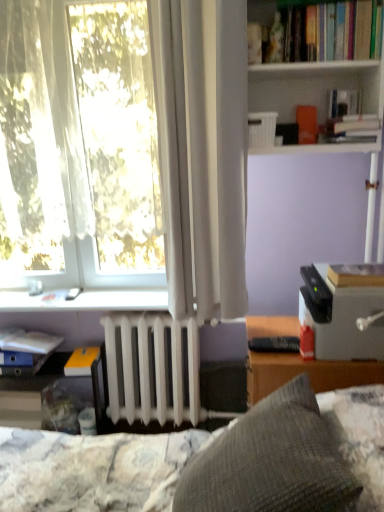
Question: Is hardcover book at right, the 1th book from the front, bigger than gray textured pillow at center?

Choices:
 (A) yes
 (B) no

Answer: (B)

Question: Is hardcover book at right, the third book viewed from the top, oriented towards gray textured pillow at center?

Choices:
 (A) no
 (B) yes

Answer: (A)

Question: Is hardcover book at right, positioned as the 5th book in back-to-front order, oriented away from gray textured pillow at center?

Choices:
 (A) yes
 (B) no

Answer: (B)

Question: Is hardcover book at right, the third book viewed from the top, next to gray textured pillow at center and touching it?

Choices:
 (A) no
 (B) yes

Answer: (A)

Question: Is hardcover book at right, the 1th book from the front, outside gray textured pillow at center?

Choices:
 (A) no
 (B) yes

Answer: (B)

Question: From a real-world perspective, is hardcover book at right, the 2th book from the right, positioned over gray textured pillow at center based on gravity?

Choices:
 (A) yes
 (B) no

Answer: (A)

Question: Is white plastic shelf at upper center, marked as the 2th shelf in a back-to-front arrangement, further to the viewer compared to white matte radiator at center?

Choices:
 (A) no
 (B) yes

Answer: (A)

Question: Is white plastic shelf at upper center, the 1th shelf viewed from the top, shorter than white matte radiator at center?

Choices:
 (A) no
 (B) yes

Answer: (A)

Question: Is white matte radiator at center located within white plastic shelf at upper center, arranged as the 1th shelf when viewed from the front?

Choices:
 (A) yes
 (B) no

Answer: (B)

Question: Considering the relative sizes of white plastic shelf at upper center, the 2th shelf from the bottom, and white matte radiator at center in the image provided, is white plastic shelf at upper center, the 2th shelf from the bottom, thinner than white matte radiator at center?

Choices:
 (A) no
 (B) yes

Answer: (A)

Question: Can you confirm if white plastic shelf at upper center, marked as the 2th shelf in a back-to-front arrangement, is taller than white matte radiator at center?

Choices:
 (A) no
 (B) yes

Answer: (B)

Question: Is white plastic shelf at upper center, the 1th shelf viewed from the top, bigger than white matte radiator at center?

Choices:
 (A) yes
 (B) no

Answer: (A)

Question: Considering the relative sizes of white plastic window sill at lower left and black plastic remote control at lower center in the image provided, is white plastic window sill at lower left shorter than black plastic remote control at lower center?

Choices:
 (A) yes
 (B) no

Answer: (B)